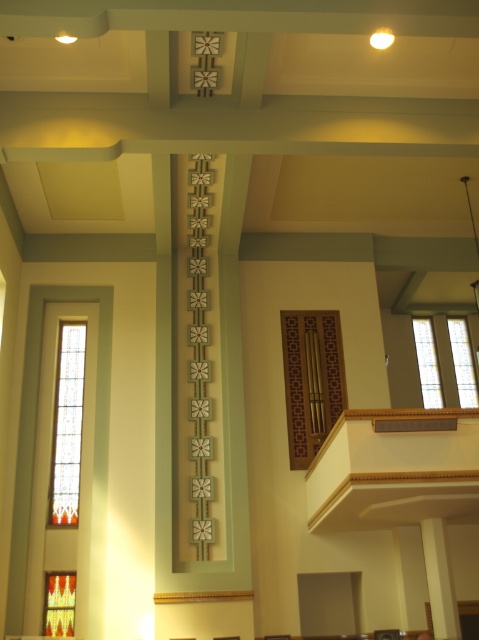
You are an interior designer planning to install a new light fixture between the stained glass at upper right and the clear glass window at upper right. The fixture requires 3 centimeters of space to avoid obstruction. Based on the scene, is there enough space between them to safely install the fixture?

The stained glass at upper right and clear glass window at upper right are 2.57 centimeters apart, which is less than the required 3 centimeters. Therefore, there isn not enough space to safely install the light fixture between them.

You are standing inside the building and want to see the view outside through the windows. Which window, the stained glass at upper right or the clear glass window at upper right, would allow you to see the outside more clearly?

The clear glass window at upper right allows for clearer visibility outside since it is behind the stained glass at upper right, which may obstruct the view with its colored patterns.

Based on the photo, you are standing in the building and want to locate both the stained glass window at left and the stained glass at upper right. Based on their positions, which one is closer to the center of the room?

The stained glass window at left is closer to the center of the room because it is positioned to the left of the stained glass at upper right, which is further to the right.